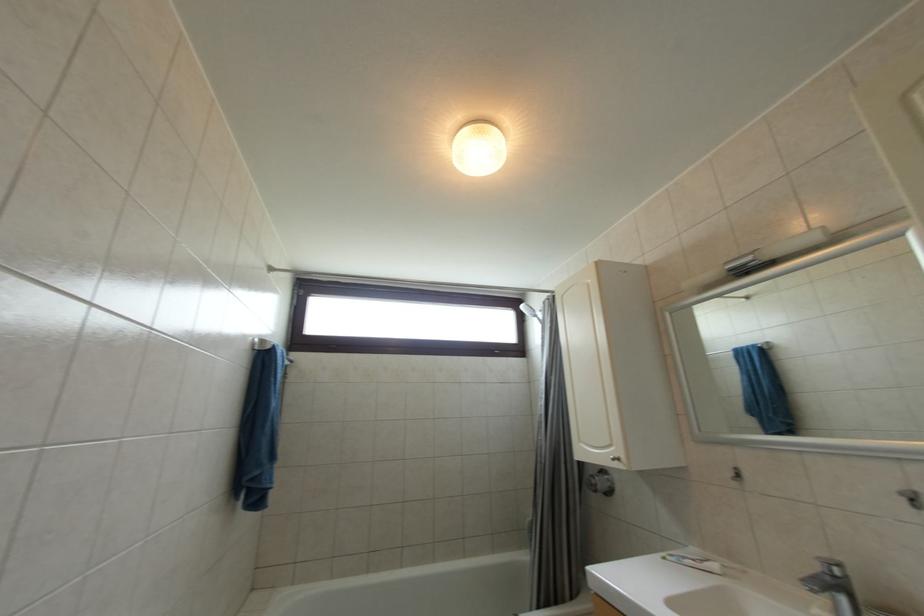
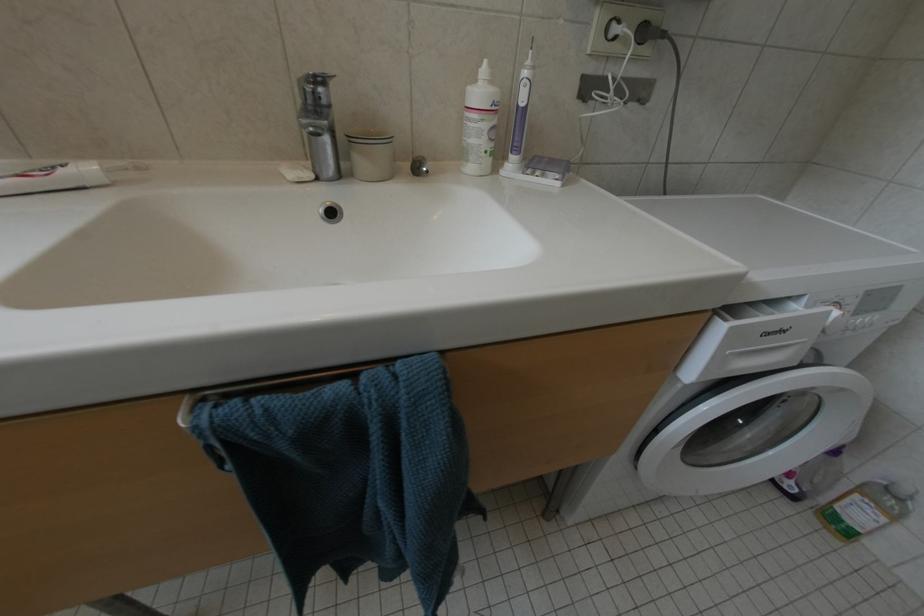
Based on the continuous images, in which direction is the camera rotating?

The camera rotated toward right-down.